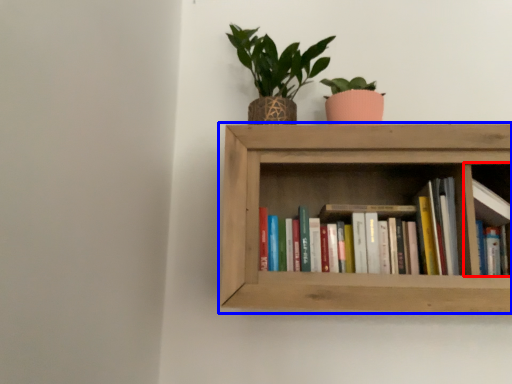
Question: Among these objects, which one is farthest to the camera, cabinet (highlighted by a red box) or shelf (highlighted by a blue box)?

Choices:
 (A) cabinet
 (B) shelf

Answer: (A)